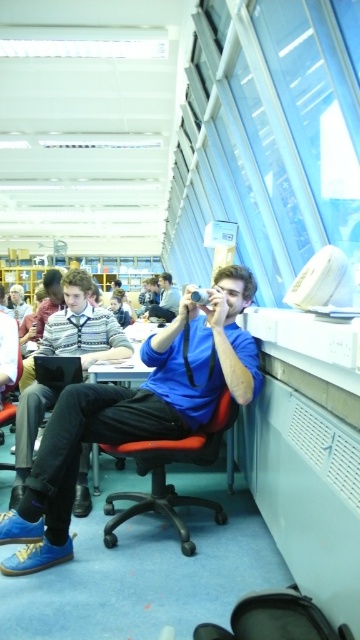
Question: Is blue suede shoes at lower left positioned in front of black plastic chair at center?

Choices:
 (A) no
 (B) yes

Answer: (B)

Question: Which point appears farthest from the camera in this image?

Choices:
 (A) (177, 305)
 (B) (151, 435)

Answer: (A)

Question: Can you confirm if matte blue shirt at center is positioned to the left of black leather chair at center?

Choices:
 (A) yes
 (B) no

Answer: (B)

Question: Which point appears farthest from the camera in this image?

Choices:
 (A) (120, 371)
 (B) (168, 321)

Answer: (B)

Question: Which point is closer to the camera?

Choices:
 (A) black plastic swivel chair at lower center
 (B) black plastic chair at center

Answer: (A)

Question: Can you confirm if black plastic swivel chair at lower center is positioned to the left of matte blue shirt at center?

Choices:
 (A) no
 (B) yes

Answer: (A)